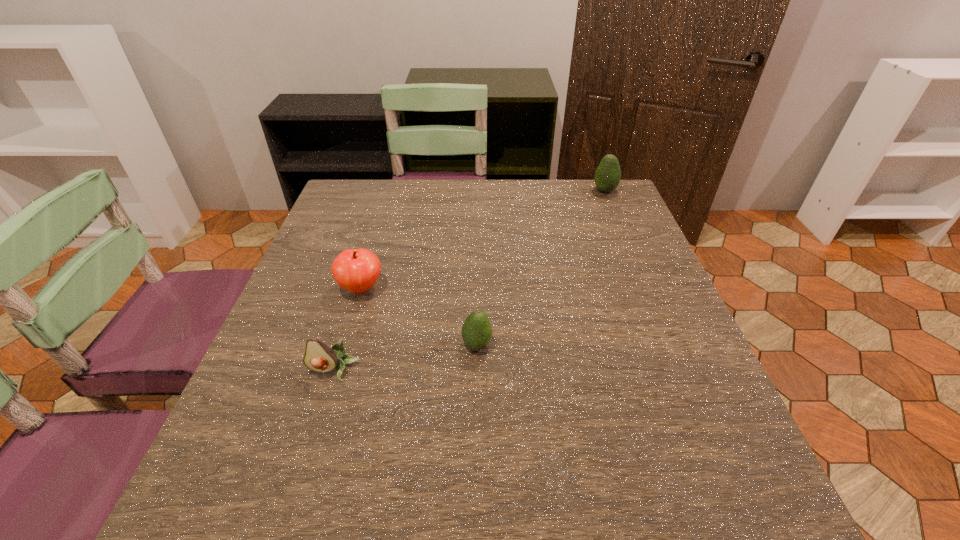
Locate an element on the screen. The height and width of the screenshot is (540, 960). the rightmost avocado is located at coordinates (607, 177).

Locate an element on the screen. This screenshot has width=960, height=540. the rightmost object is located at coordinates (607, 177).

You are a GUI agent. You are given a task and a screenshot of the screen. Output one action in this format:
    pyautogui.click(x=<x>, y=<y>)
    Task: Click on the third nearest object
    The image size is (960, 540).
    Given the screenshot: What is the action you would take?
    pyautogui.click(x=356, y=270)

This screenshot has height=540, width=960. What are the coordinates of `the nearest object` in the screenshot? It's located at (319, 357).

Where is `the nearest avocado`? The height and width of the screenshot is (540, 960). the nearest avocado is located at coordinates (319, 357).

Where is `the third farthest object`? The width and height of the screenshot is (960, 540). the third farthest object is located at coordinates (476, 331).

Image resolution: width=960 pixels, height=540 pixels. Identify the location of the second avocado from left to right. (476, 331).

The height and width of the screenshot is (540, 960). I want to click on vacant space located 0.320m on the front of the farthest object, so click(x=636, y=266).

This screenshot has height=540, width=960. What are the coordinates of `free location located 0.350m on the back of the third nearest object` in the screenshot? It's located at (389, 197).

This screenshot has height=540, width=960. What are the coordinates of `vacant space located 0.220m on the seed side of the leftmost avocado` in the screenshot? It's located at (293, 508).